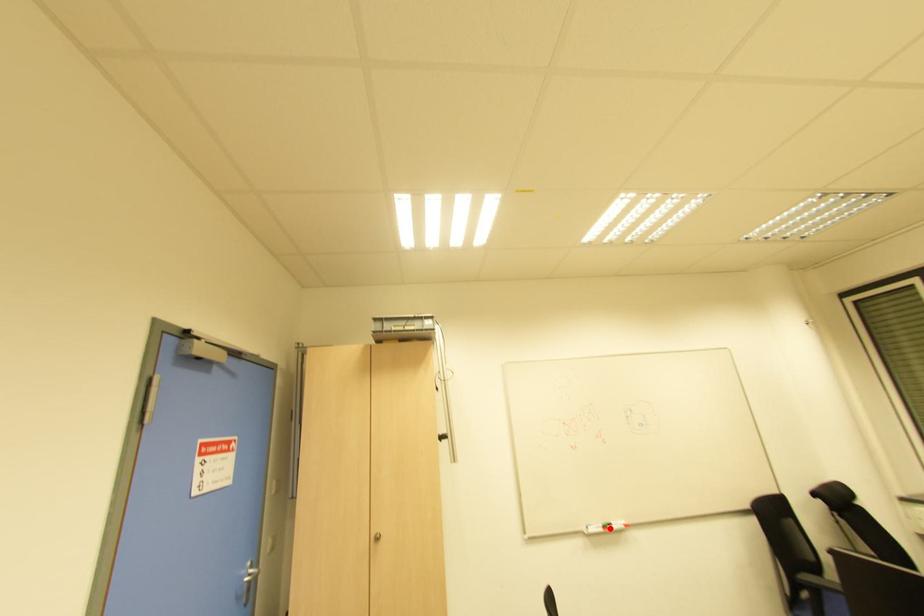
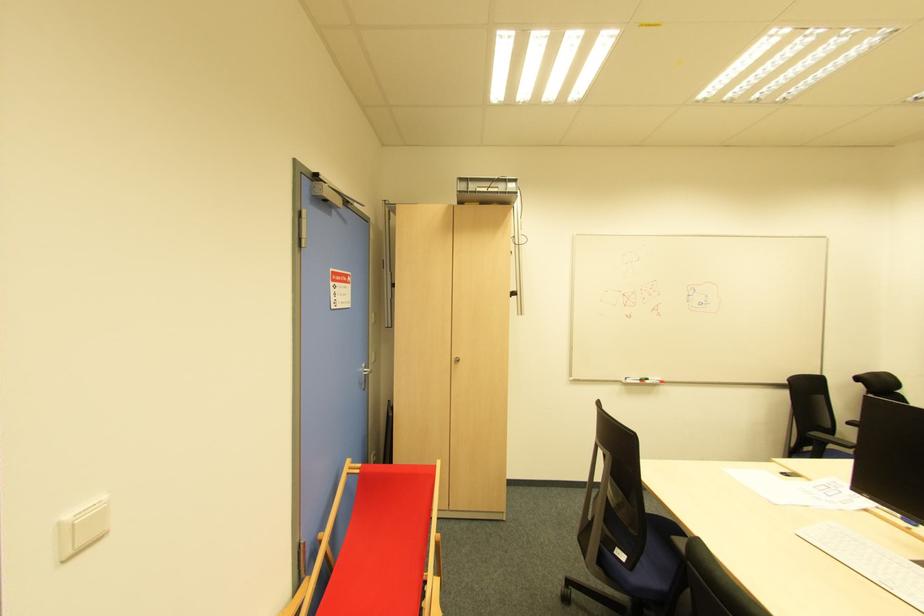
Locate, in the second image, the point that corresponds to the highlighted location in the first image.

(647, 383)